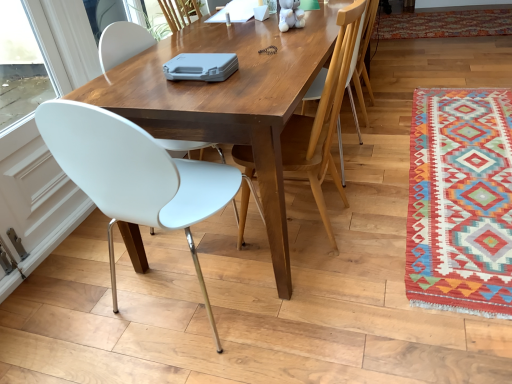
Where is `free location to the left of white plastic chair at left, which is the 3th chair in right-to-left order`? free location to the left of white plastic chair at left, which is the 3th chair in right-to-left order is located at coordinates (73, 305).